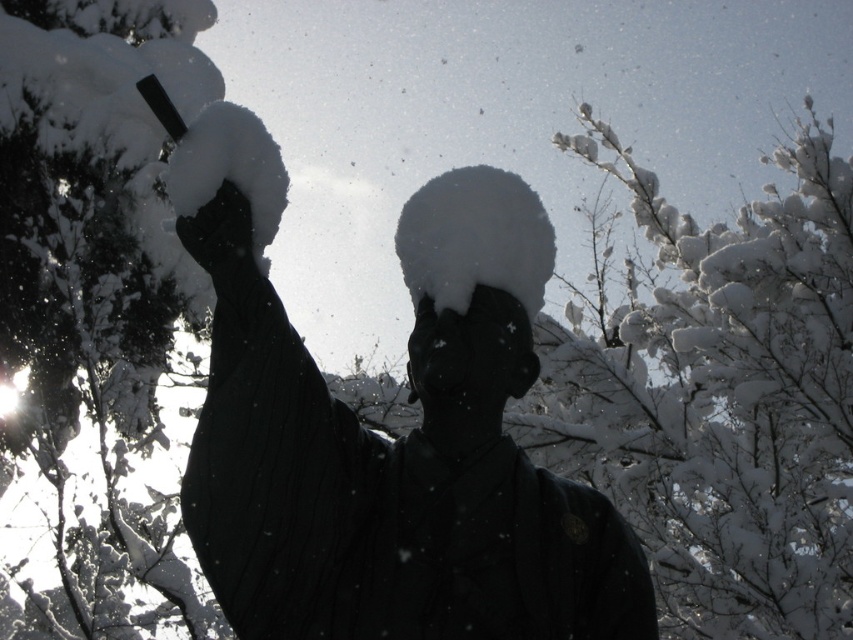
Question: Can you confirm if snow-covered branch at upper left is smaller than black matte hand at upper left?

Choices:
 (A) no
 (B) yes

Answer: (A)

Question: Among these points, which one is nearest to the camera?

Choices:
 (A) (219, 250)
 (B) (462, 260)
 (C) (728, 532)
 (D) (466, 461)

Answer: (A)

Question: Does snow-covered branch at upper left come in front of black matte hand at upper left?

Choices:
 (A) no
 (B) yes

Answer: (A)

Question: Based on their relative distances, which object is farther from the snowy branches at upper right?

Choices:
 (A) white snow-covered head at center
 (B) black matte statue at center
 (C) black matte hand at upper left
 (D) snow-covered branch at upper left

Answer: (C)

Question: Which object is the closest to the snow-covered branch at upper left?

Choices:
 (A) black matte statue at center
 (B) white snow-covered head at center

Answer: (B)

Question: Does black matte statue at center lie in front of snowy branches at upper right?

Choices:
 (A) no
 (B) yes

Answer: (B)